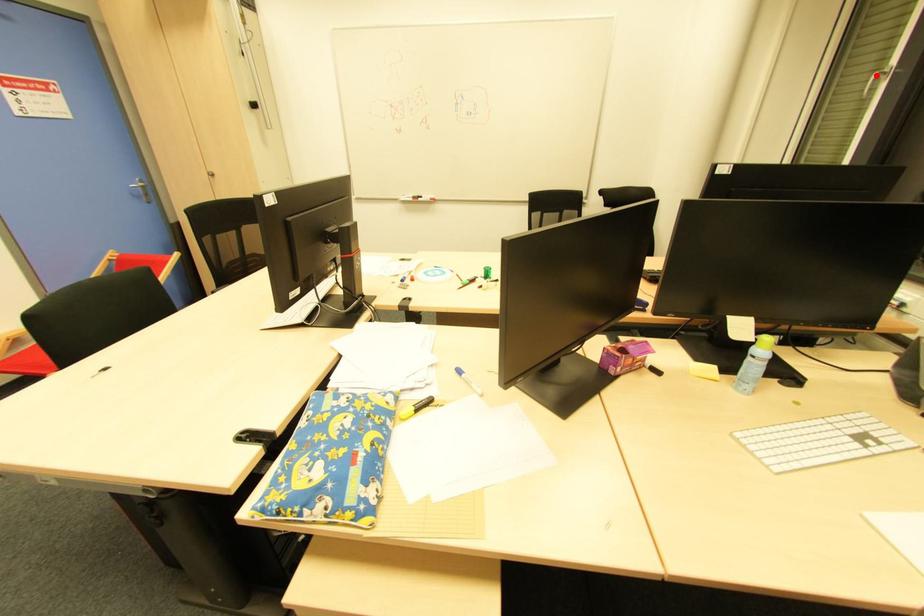
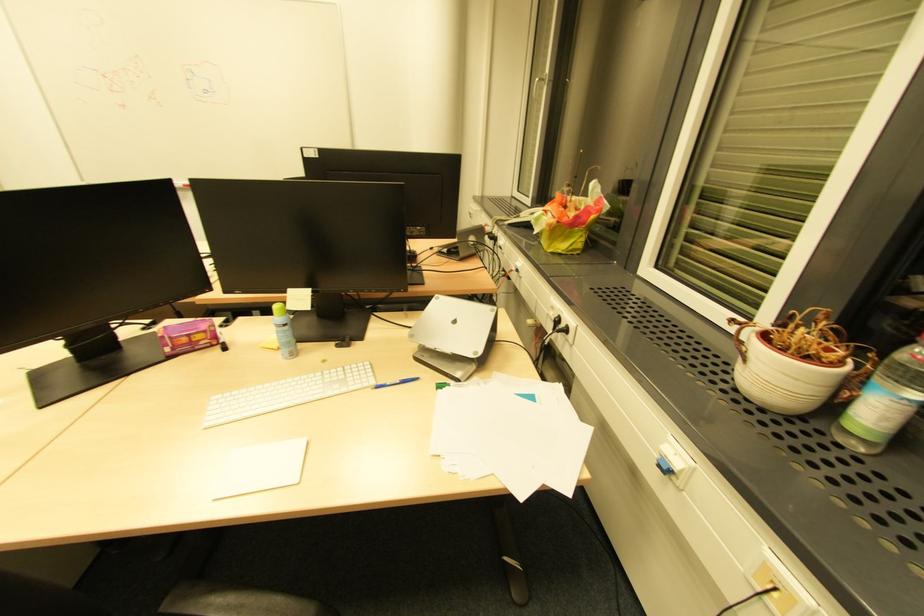
Question: I am providing you with two images of the same scene from different viewpoints. In image1, a red point is highlighted. Considering the same 3D point in image2, which of the following is correct?

Choices:
 (A) It is closer
 (B) It is farther

Answer: (A)